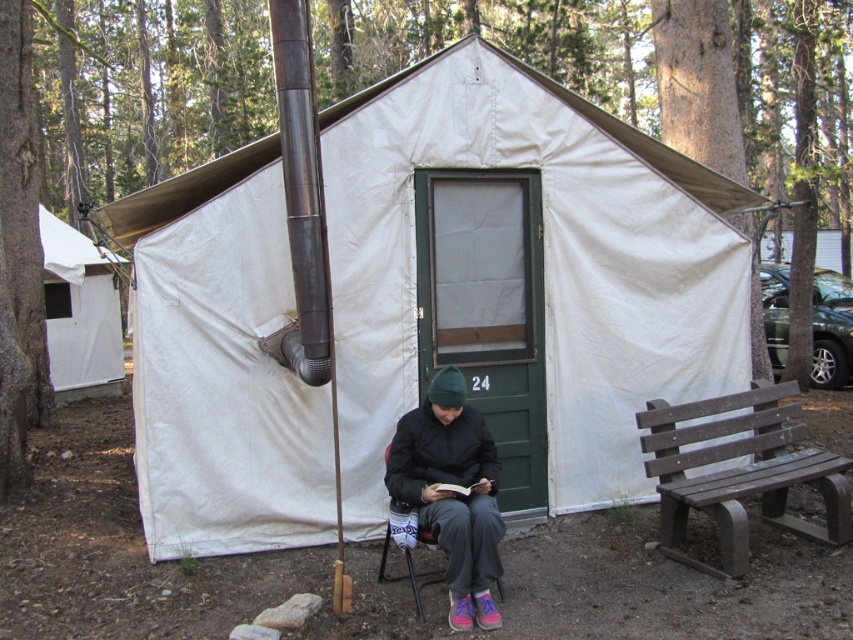
You are planning to set up a small table between the brown plastic bench at right and the metallic gray chair at center for a campfire snack. Considering their heights, which object should the table be placed closer to to ensure stability?

The brown plastic bench at right is taller than the metallic gray chair at center. To ensure stability, the table should be placed closer to the brown plastic bench at right because its height will provide a more level surface.

You are planning to set up a picnic blanket between the white canvas tent at center and the brown plastic bench at right. Given that the picnic blanket is 2 meters wide, will it fit between them?

The white canvas tent at center is wider than the brown plastic bench at right. However, the exact distance between them isn

You are planning to set up a small flagpole in the campsite. The flagpole requires a minimum height of 2 meters to be safely anchored. Based on the scene, can the white canvas tent at center and the metallic gray chair at center help determine if the flagpole can be placed here?

The white canvas tent at center is much taller than the metallic gray chair at center. Since the tent is significantly taller, it might meet the 2 meter requirement for the flagpole. However, without exact measurements, we cannot be certain. Check the tent height first.